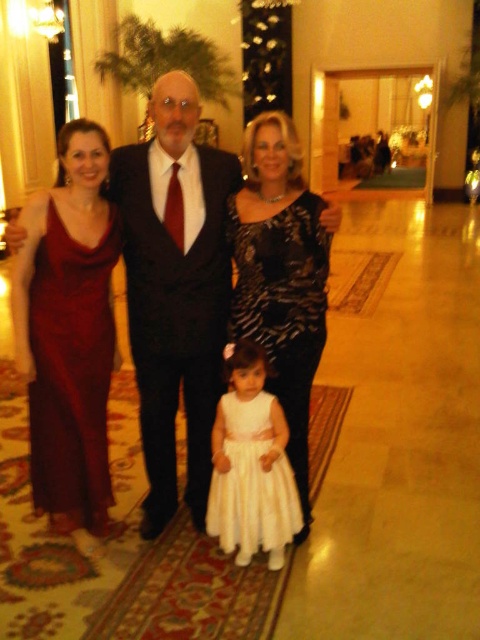
You are a photographer at a formal event. You notice two outfits at the center of the group photo. The dark blue wool suit at center and the black textured dress at center. Which outfit is closer to the camera?

The dark blue wool suit at center is closer to the camera because the black textured dress at center is behind it.

You are a photographer adjusting the lighting for a group photo. You notice two central items of clothing in the scene. Which one of these, the dark blue wool suit at center or the white satin dress at center, requires more upward adjustment of the spotlight to fully illuminate its upper portion?

The dark blue wool suit at center is much taller than the white satin dress at center, so the spotlight needs to be raised higher to fully illuminate its upper portion.

You are a photographer adjusting the lighting for a group photo. You need to ensure that both the dark blue wool suit at center and the white satin dress at center are evenly lit. Given their distance apart, will you need to adjust the lighting setup to accommodate their spacing?

The dark blue wool suit at center is 14.67 inches away from the white satin dress at center. Since this distance is relatively small, the existing lighting setup should suffice to evenly illuminate both without needing major adjustments.